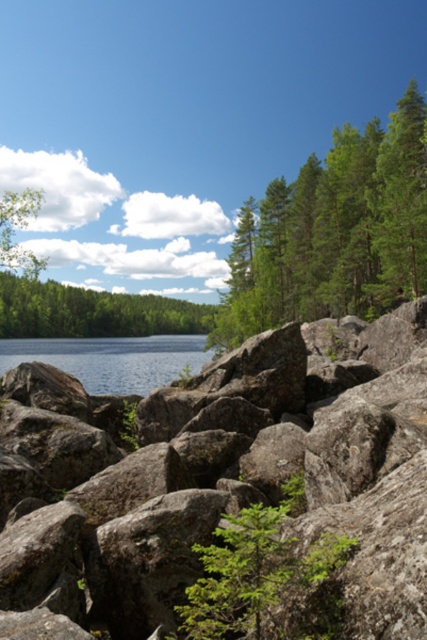
Question: Which point is closer to the camera taking this photo?

Choices:
 (A) (298, 301)
 (B) (110, 355)

Answer: (A)

Question: Can you confirm if gray rough boulder at center is positioned above green leafy tree at center?

Choices:
 (A) yes
 (B) no

Answer: (A)

Question: Does green leafy tree at center have a lesser width compared to blue water at center?

Choices:
 (A) yes
 (B) no

Answer: (A)

Question: Which point is closer to the camera?

Choices:
 (A) (117, 506)
 (B) (300, 620)
 (C) (157, 317)

Answer: (B)

Question: Which is farther from the green leafy tree at upper right?

Choices:
 (A) green leafy trees at center
 (B) green leafy tree at center
 (C) blue water at center
 (D) gray rough boulder at center

Answer: (A)

Question: Is gray rough boulder at center thinner than green leafy tree at center?

Choices:
 (A) no
 (B) yes

Answer: (A)